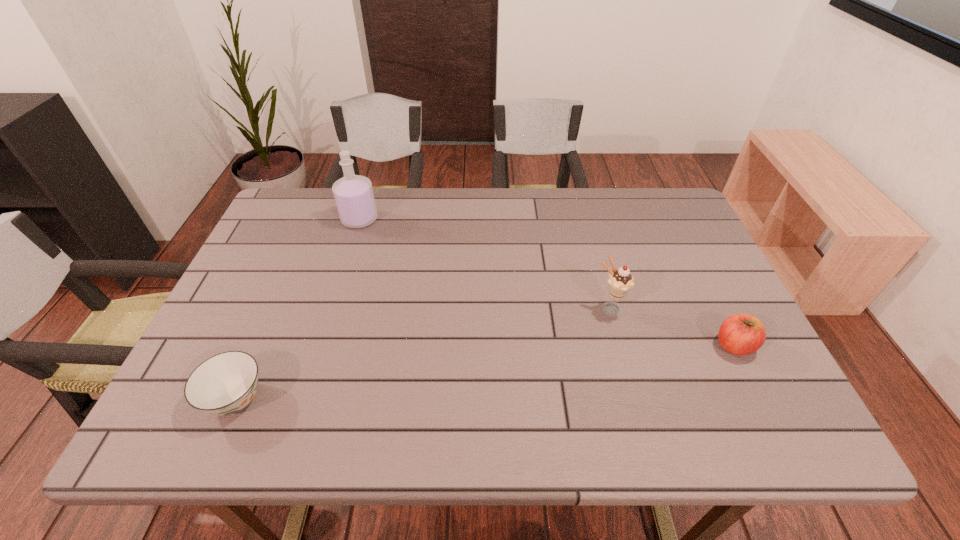
You are a GUI agent. You are given a task and a screenshot of the screen. Output one action in this format:
    pyautogui.click(x=<x>, y=<y>)
    Task: Click on the vacant area at the far left corner of the desktop
    The height and width of the screenshot is (540, 960).
    Given the screenshot: What is the action you would take?
    pyautogui.click(x=312, y=210)

Where is `vacant region at the near left corner`? This screenshot has height=540, width=960. vacant region at the near left corner is located at coordinates [x=178, y=433].

I want to click on free space at the far right corner of the desktop, so click(658, 204).

Find the location of a particular element. free spot between the apple and the farthest object is located at coordinates (547, 282).

The width and height of the screenshot is (960, 540). What are the coordinates of `free area in between the second nearest object and the third nearest object` in the screenshot? It's located at (672, 328).

Identify the location of free space between the tallest object and the third nearest object. (485, 265).

This screenshot has width=960, height=540. I want to click on vacant space in between the apple and the nearest object, so click(x=485, y=372).

The height and width of the screenshot is (540, 960). Find the location of `free area in between the second object from left to right and the shortest object`. free area in between the second object from left to right and the shortest object is located at coordinates (298, 309).

Find the location of a particular element. The height and width of the screenshot is (540, 960). vacant area between the perfume and the third shortest object is located at coordinates (485, 265).

The height and width of the screenshot is (540, 960). Identify the location of free spot between the rightmost object and the tallest object. (547, 282).